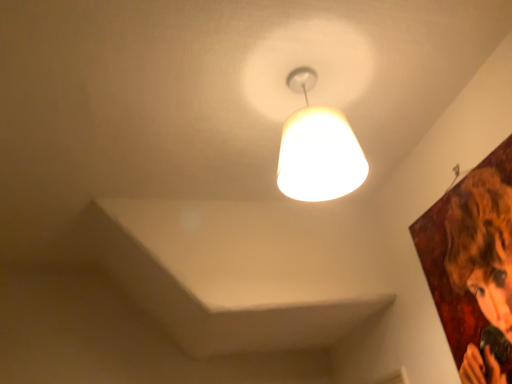
Question: Is smooth brown hair at upper right in contact with matte white lampshade at upper center?

Choices:
 (A) yes
 (B) no

Answer: (B)

Question: Is there a large distance between smooth brown hair at upper right and matte white lampshade at upper center?

Choices:
 (A) yes
 (B) no

Answer: (B)

Question: Is smooth brown hair at upper right wider than matte white lampshade at upper center?

Choices:
 (A) no
 (B) yes

Answer: (A)

Question: Is smooth brown hair at upper right oriented away from matte white lampshade at upper center?

Choices:
 (A) no
 (B) yes

Answer: (A)

Question: Does smooth brown hair at upper right have a lesser width compared to matte white lampshade at upper center?

Choices:
 (A) yes
 (B) no

Answer: (A)

Question: From the image's perspective, is smooth brown hair at upper right below matte white lampshade at upper center?

Choices:
 (A) no
 (B) yes

Answer: (B)

Question: Is matte white lampshade at upper center taller than smooth brown hair at upper right?

Choices:
 (A) no
 (B) yes

Answer: (A)

Question: Would you say matte white lampshade at upper center is a long distance from smooth brown hair at upper right?

Choices:
 (A) no
 (B) yes

Answer: (A)

Question: Is matte white lampshade at upper center further to camera compared to smooth brown hair at upper right?

Choices:
 (A) no
 (B) yes

Answer: (B)

Question: From a real-world perspective, is matte white lampshade at upper center physically below smooth brown hair at upper right?

Choices:
 (A) no
 (B) yes

Answer: (A)

Question: Considering the relative sizes of matte white lampshade at upper center and smooth brown hair at upper right in the image provided, is matte white lampshade at upper center shorter than smooth brown hair at upper right?

Choices:
 (A) no
 (B) yes

Answer: (B)

Question: Is matte white lampshade at upper center at the left side of smooth brown hair at upper right?

Choices:
 (A) yes
 (B) no

Answer: (A)

Question: From the image's perspective, relative to matte white lampshade at upper center, is smooth brown hair at upper right above or below?

Choices:
 (A) below
 (B) above

Answer: (A)